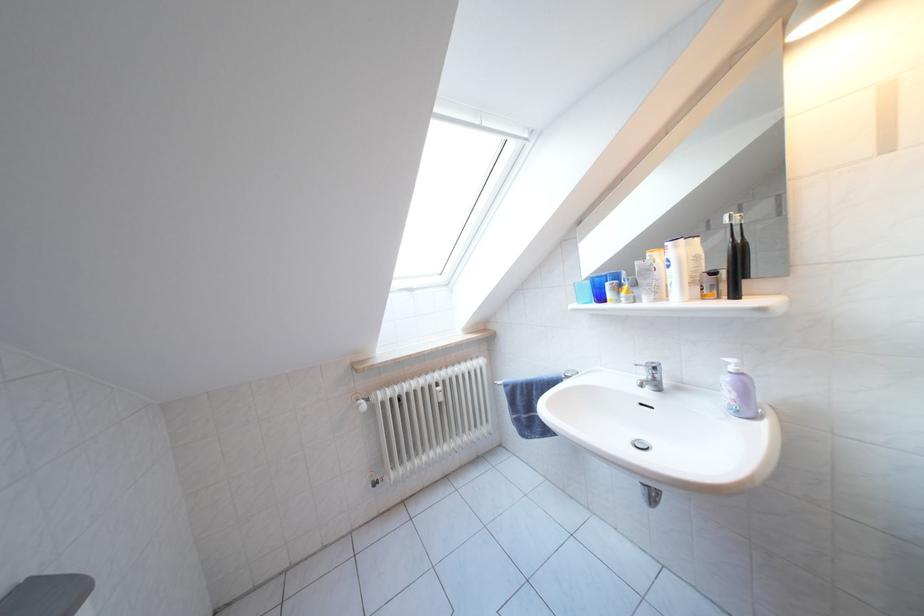
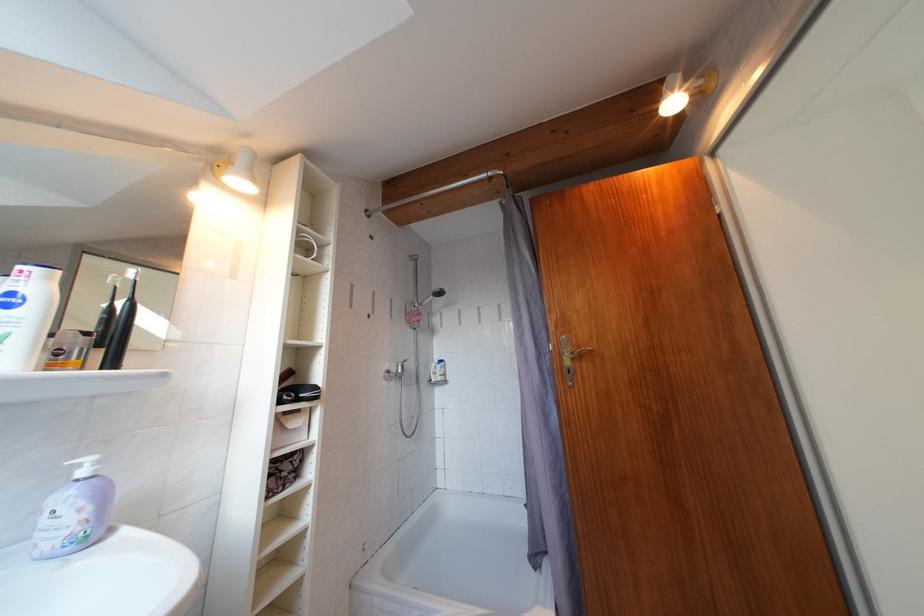
Question: I am providing you with two images of the same scene from different viewpoints. After the viewpoint changes to image2, which objects are now occluded?

Choices:
 (A) white shower bottle
 (B) shower faucet handle
 (C) pink shower sponge
 (D) none of these

Answer: (D)